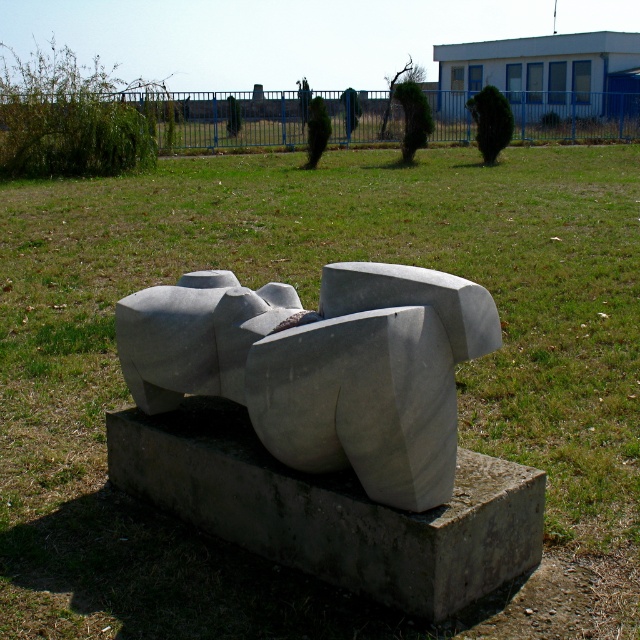
You are standing 10 feet away from a gray stone sculpture at center. Can you comfortably walk up to it without needing to move any obstacles?

The gray stone sculpture at center is 9.25 feet away from the viewer, so yes, you can comfortably walk up to it without needing to move any obstacles since the distance is within the 10 feet range.

You are an artist planning to transport both the gray stone sculpture at center and the gray concrete sculpture at center to a gallery. The gallery has a narrow doorway that can only accommodate items up to the width of the narrower sculpture. Which sculpture can safely pass through the doorway without needing adjustments?

The gray stone sculpture at center can safely pass through the doorway since its width is less than that of the gray concrete sculpture at center.